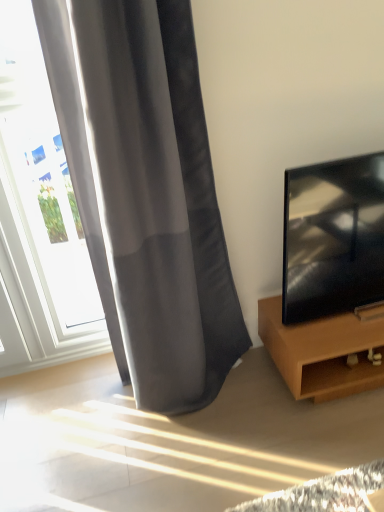
Question: Is satin gray curtain at left at the back of black glossy tv at right?

Choices:
 (A) yes
 (B) no

Answer: (B)

Question: Would you consider black glossy tv at right to be distant from satin gray curtain at left?

Choices:
 (A) yes
 (B) no

Answer: (B)

Question: Is black glossy tv at right shorter than satin gray curtain at left?

Choices:
 (A) no
 (B) yes

Answer: (B)

Question: Can you confirm if black glossy tv at right is positioned to the right of satin gray curtain at left?

Choices:
 (A) yes
 (B) no

Answer: (A)

Question: Considering the relative sizes of black glossy tv at right and satin gray curtain at left in the image provided, is black glossy tv at right taller than satin gray curtain at left?

Choices:
 (A) yes
 (B) no

Answer: (B)

Question: Is white glass window at left in front of or behind satin gray curtain at left in the image?

Choices:
 (A) front
 (B) behind

Answer: (B)

Question: From a real-world perspective, is white glass window at left positioned above or below satin gray curtain at left?

Choices:
 (A) below
 (B) above

Answer: (A)

Question: Does point click(16, 169) appear closer or farther from the camera than point click(99, 18)?

Choices:
 (A) farther
 (B) closer

Answer: (A)

Question: Would you say white glass window at left is to the left or to the right of satin gray curtain at left in the picture?

Choices:
 (A) right
 (B) left

Answer: (B)

Question: Visually, is satin gray curtain at left positioned to the left or to the right of black glossy tv at right?

Choices:
 (A) right
 (B) left

Answer: (B)

Question: From a real-world perspective, is satin gray curtain at left above or below black glossy tv at right?

Choices:
 (A) below
 (B) above

Answer: (B)

Question: In terms of width, does satin gray curtain at left look wider or thinner when compared to black glossy tv at right?

Choices:
 (A) thin
 (B) wide

Answer: (B)

Question: From their relative heights in the image, would you say satin gray curtain at left is taller or shorter than black glossy tv at right?

Choices:
 (A) tall
 (B) short

Answer: (A)

Question: Is point (321, 208) closer or farther from the camera than point (160, 212)?

Choices:
 (A) closer
 (B) farther

Answer: (B)

Question: Is black glossy tv at right in front of or behind satin gray curtain at left in the image?

Choices:
 (A) front
 (B) behind

Answer: (B)